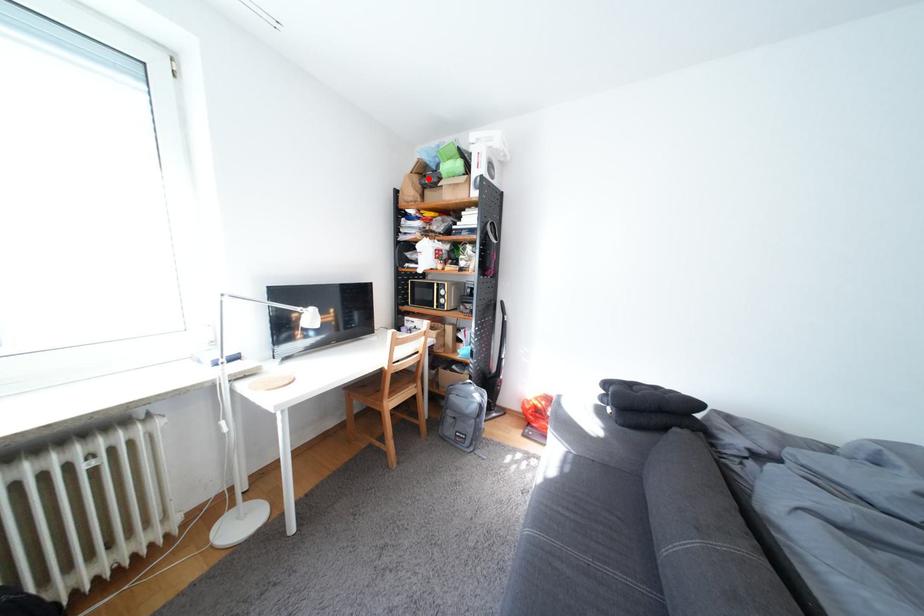
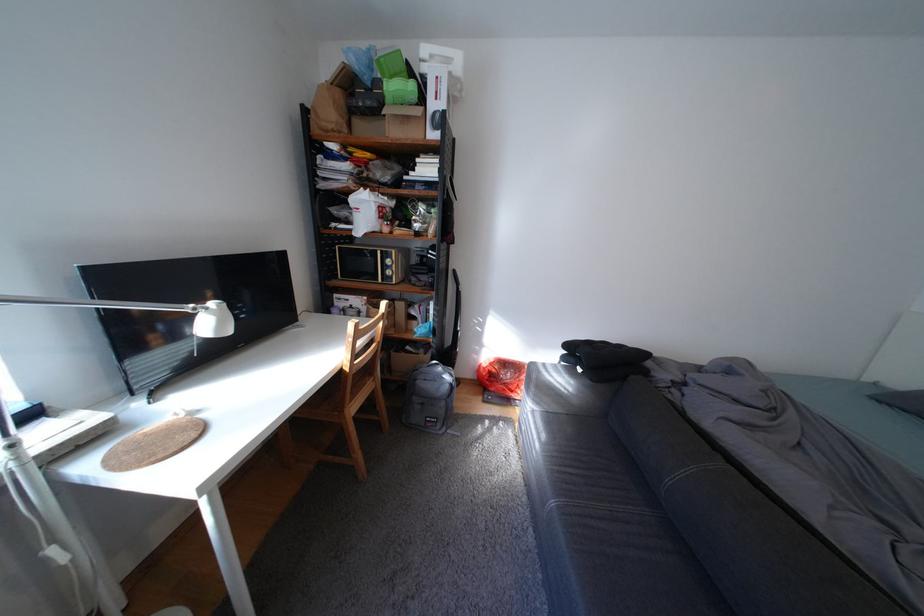
Find the pixel in the second image that matches the highlighted location in the first image.

(351, 95)